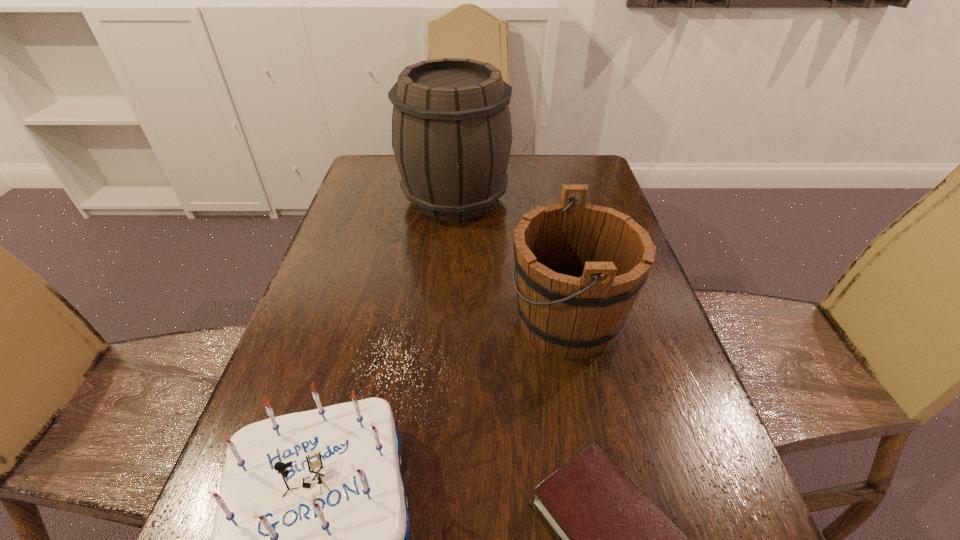
Where is `object positioned at the right edge`? The height and width of the screenshot is (540, 960). object positioned at the right edge is located at coordinates (580, 267).

Where is `object at the far left corner`? The height and width of the screenshot is (540, 960). object at the far left corner is located at coordinates (451, 125).

The height and width of the screenshot is (540, 960). I want to click on vacant point at the far edge, so click(x=545, y=160).

I want to click on free space at the left edge, so coord(348,233).

Identify the location of vacant point at the right edge. The height and width of the screenshot is (540, 960). (591, 198).

Find the location of a particular element. The image size is (960, 540). free region at the far left corner is located at coordinates (386, 165).

In the image, there is a desktop. In order to click on vacant space at the far right corner in this screenshot , I will do `click(592, 170)`.

You are a GUI agent. You are given a task and a screenshot of the screen. Output one action in this format:
    pyautogui.click(x=<x>, y=<y>)
    Task: Click on the empty location between the nearer wine bucket and the taller wine bucket
    The height and width of the screenshot is (540, 960).
    Given the screenshot: What is the action you would take?
    pyautogui.click(x=512, y=259)

Select which object is the third closest to the third tallest object. Please provide its 2D coordinates. Your answer should be formatted as a tuple, i.e. [(x, y)], where the tuple contains the x and y coordinates of a point satisfying the conditions above.

[(451, 125)]

Choose which object is the third nearest neighbor to the birthday cake. Please provide its 2D coordinates. Your answer should be formatted as a tuple, i.e. [(x, y)], where the tuple contains the x and y coordinates of a point satisfying the conditions above.

[(451, 125)]